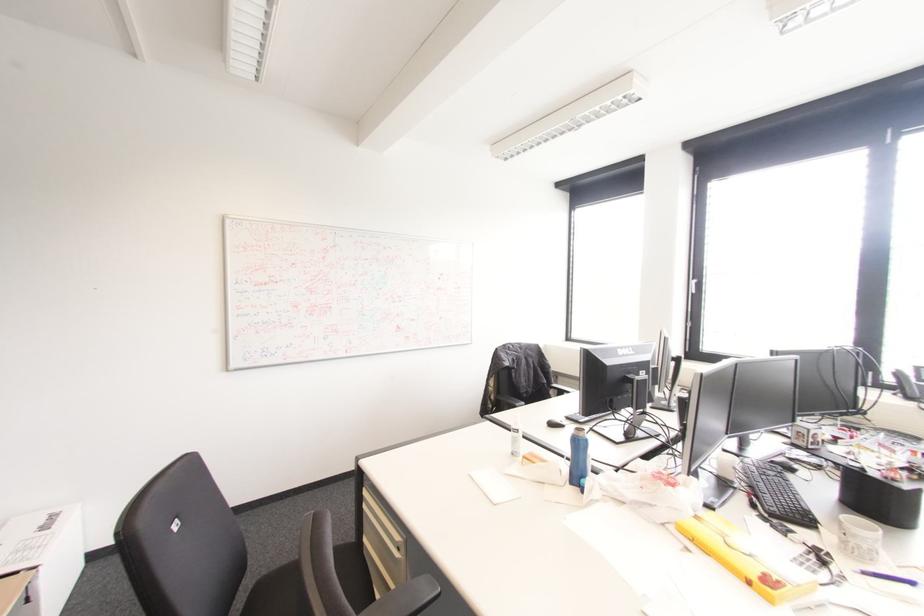
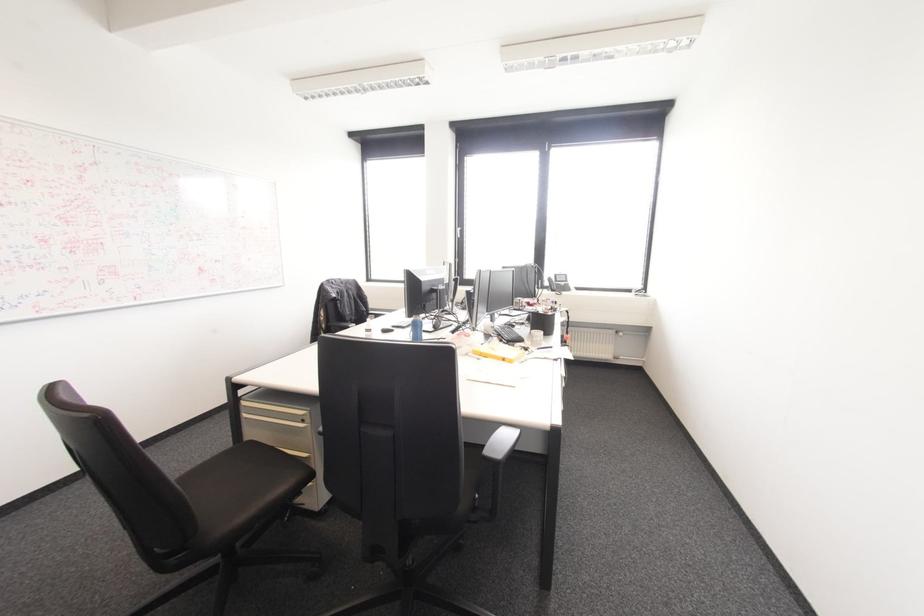
Find the pixel in the second image that matches the point at 580,434 in the first image.

(418, 318)